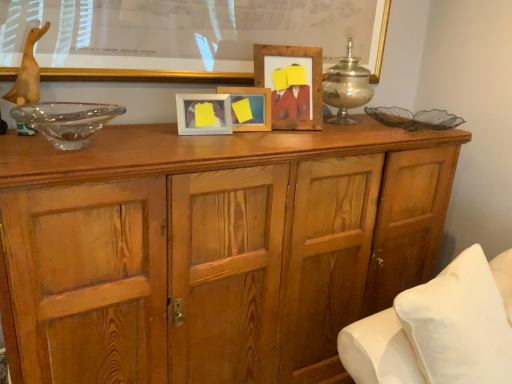
Where is `vacant space situated on the left part of matte wooden picture frame at center, acting as the first picture frame starting from the left`? vacant space situated on the left part of matte wooden picture frame at center, acting as the first picture frame starting from the left is located at coordinates (151, 125).